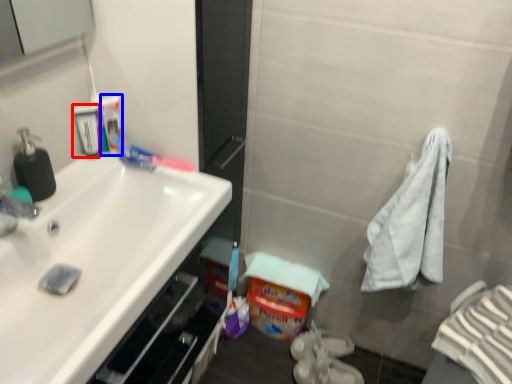
Question: Which object appears farthest to the camera in this image, mouthwash (highlighted by a red box) or mouthwash (highlighted by a blue box)?

Choices:
 (A) mouthwash
 (B) mouthwash

Answer: (B)